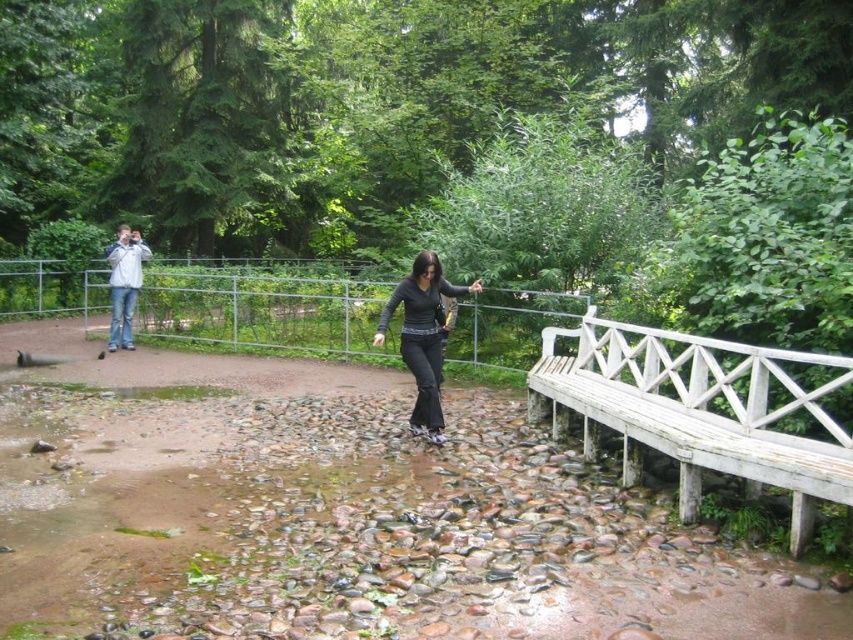
From the picture: Can you confirm if metallic wire fence at upper center is positioned to the left of black matte pants at center?

Correct, you'll find metallic wire fence at upper center to the left of black matte pants at center.

Which is more to the left, metallic wire fence at upper center or black matte pants at center?

From the viewer's perspective, metallic wire fence at upper center appears more on the left side.

Which is behind, point (198, 296) or point (442, 324)?

The point (198, 296) is behind.

Locate an element on the screen. This screenshot has height=640, width=853. metallic wire fence at upper center is located at coordinates (262, 308).

Is white wooden bench at right taller than jeans at left?

No.

Between white wooden bench at right and jeans at left, which one is positioned lower?

white wooden bench at right is below.

You are a GUI agent. You are given a task and a screenshot of the screen. Output one action in this format:
    pyautogui.click(x=<x>, y=<y>)
    Task: Click on the white wooden bench at right
    The height and width of the screenshot is (640, 853).
    Given the screenshot: What is the action you would take?
    pyautogui.click(x=700, y=410)

From the picture: Does white wooden bench at right have a lesser width compared to metallic wire fence at upper center?

Indeed, white wooden bench at right has a lesser width compared to metallic wire fence at upper center.

Can you confirm if white wooden bench at right is positioned to the right of metallic wire fence at upper center?

Correct, you'll find white wooden bench at right to the right of metallic wire fence at upper center.

Does point (724, 428) lie in front of point (196, 284)?

Yes, point (724, 428) is in front of point (196, 284).

Image resolution: width=853 pixels, height=640 pixels. I want to click on white wooden bench at right, so click(x=700, y=410).